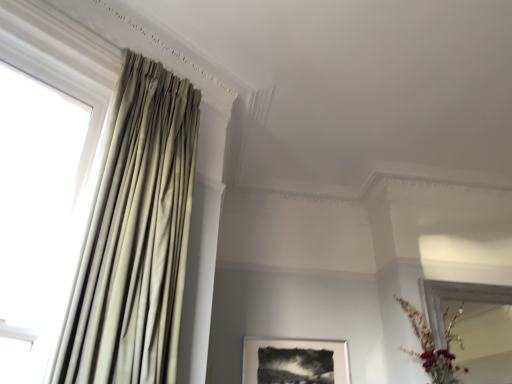
Question: Considering their positions, is white fabric curtain at left located in front of or behind satin beige curtain at left?

Choices:
 (A) front
 (B) behind

Answer: (A)

Question: Considering the relative positions of white fabric curtain at left and satin beige curtain at left in the image provided, is white fabric curtain at left to the left or to the right of satin beige curtain at left?

Choices:
 (A) right
 (B) left

Answer: (B)

Question: Which is farther from the white fabric curtain at left?

Choices:
 (A) satin beige curtain at left
 (B) matte gold vase at lower right
 (C) black matte picture frame at center

Answer: (B)

Question: Based on their relative distances, which object is farther from the white fabric curtain at left?

Choices:
 (A) satin beige curtain at left
 (B) matte gold vase at lower right
 (C) black matte picture frame at center

Answer: (B)